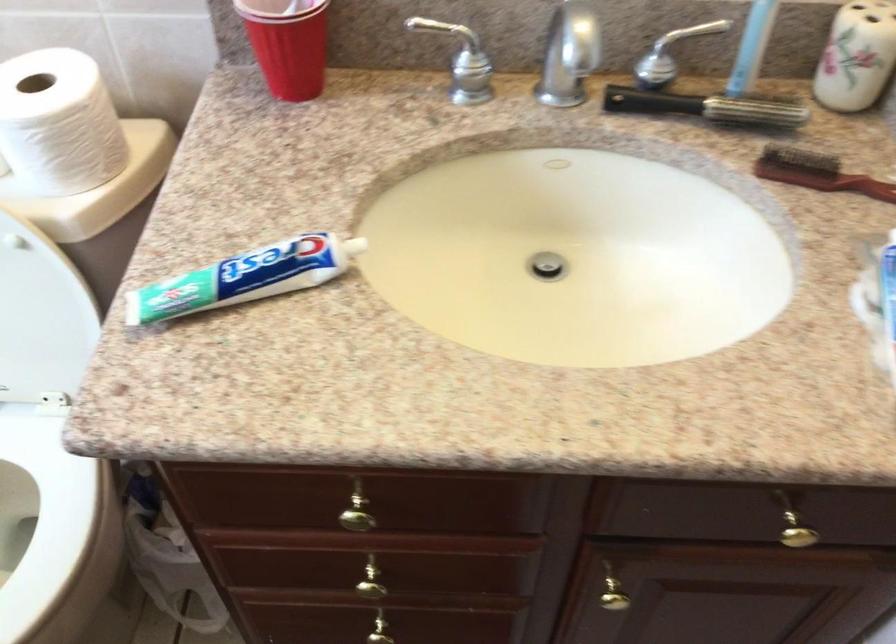
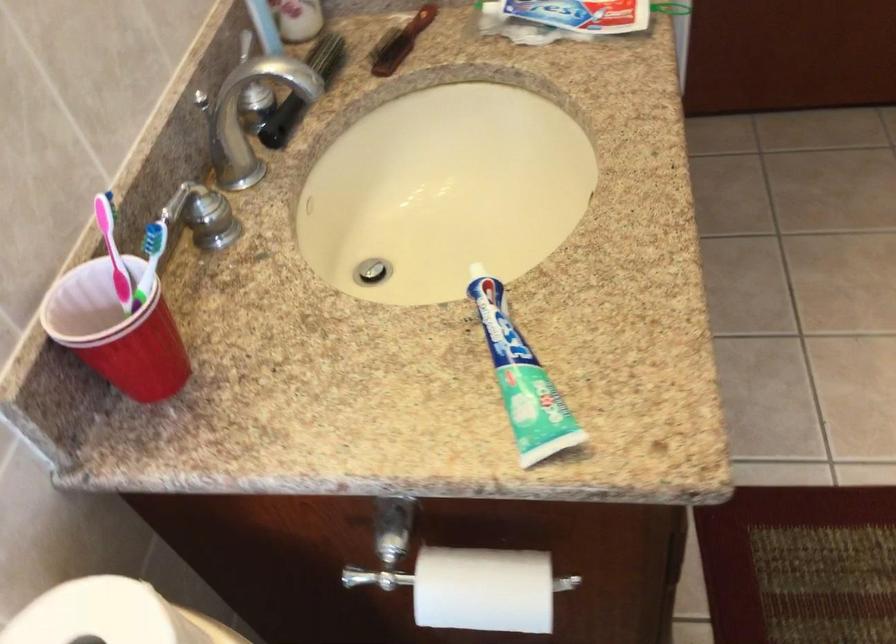
The first image is from the beginning of the video and the second image is from the end. How did the camera likely rotate when shooting the video?

The camera's rotation is toward right-down.